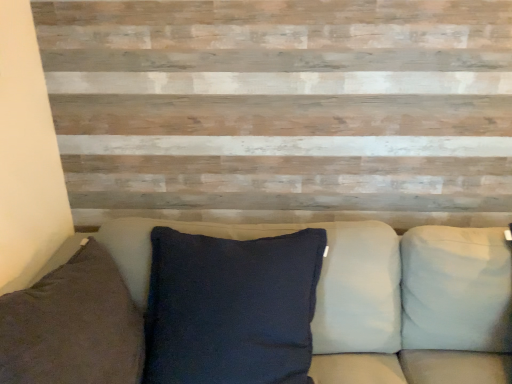
Question: Is point (95, 354) positioned closer to the camera than point (457, 236)?

Choices:
 (A) closer
 (B) farther

Answer: (A)

Question: From a real-world perspective, relative to white fabric pillow at right, the 1th pillow positioned from the right, is dark blue fabric pillow at left, the first pillow from the left, vertically above or below?

Choices:
 (A) below
 (B) above

Answer: (B)

Question: Based on their relative distances, which object is nearer to the dark fabric cushion at center?

Choices:
 (A) white fabric pillow at right, marked as the second pillow in a left-to-right arrangement
 (B) dark blue fabric pillow at left, the first pillow from the left

Answer: (A)

Question: Which object is positioned closest to the dark fabric cushion at center?

Choices:
 (A) white fabric pillow at right, marked as the second pillow in a left-to-right arrangement
 (B) dark blue fabric pillow at left, the first pillow from the left

Answer: (A)